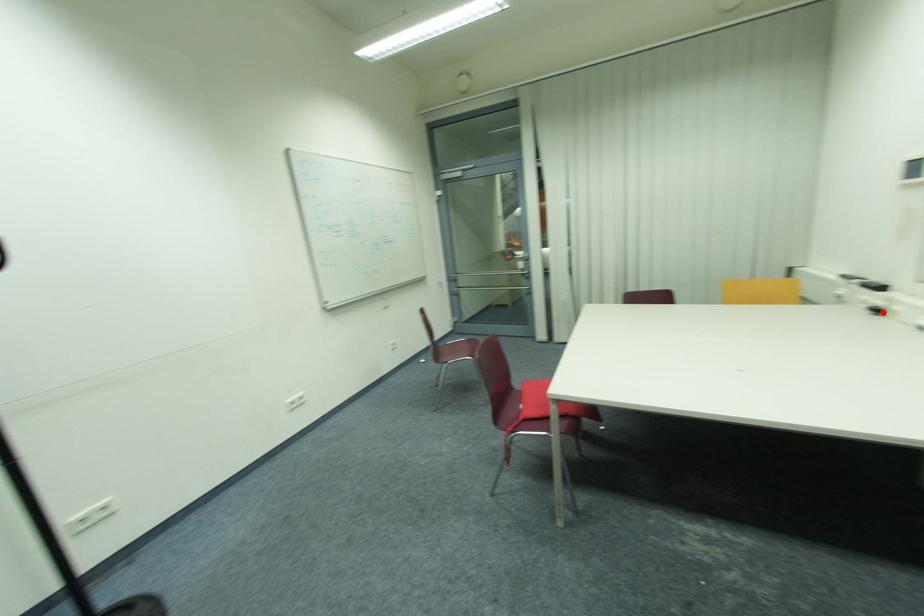
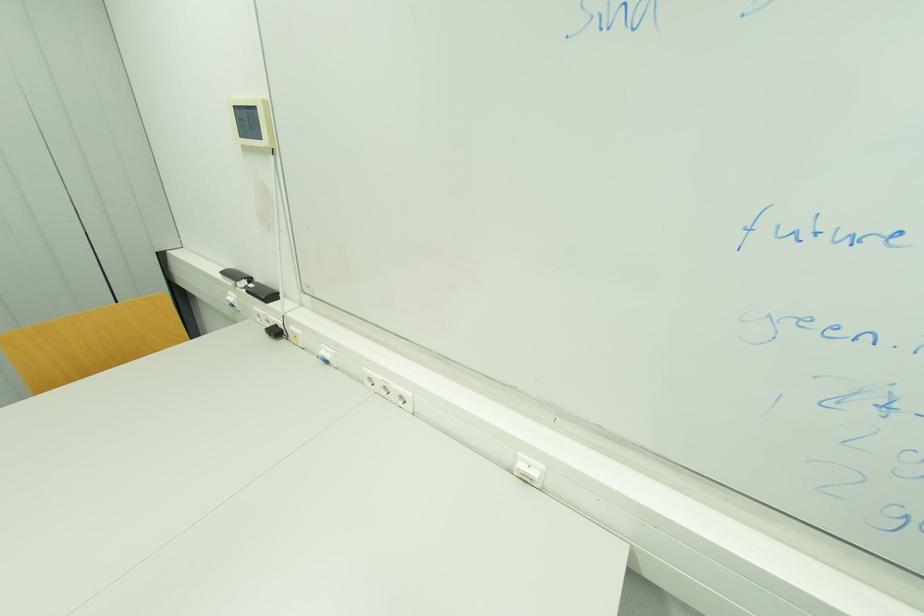
Question: I am providing you with two images of the same scene from different viewpoints. Image1 has a red point marked. In image2, the corresponding 3D location appears at what relative position? Reply with the corresponding letter.

Choices:
 (A) Closer
 (B) Farther

Answer: (A)